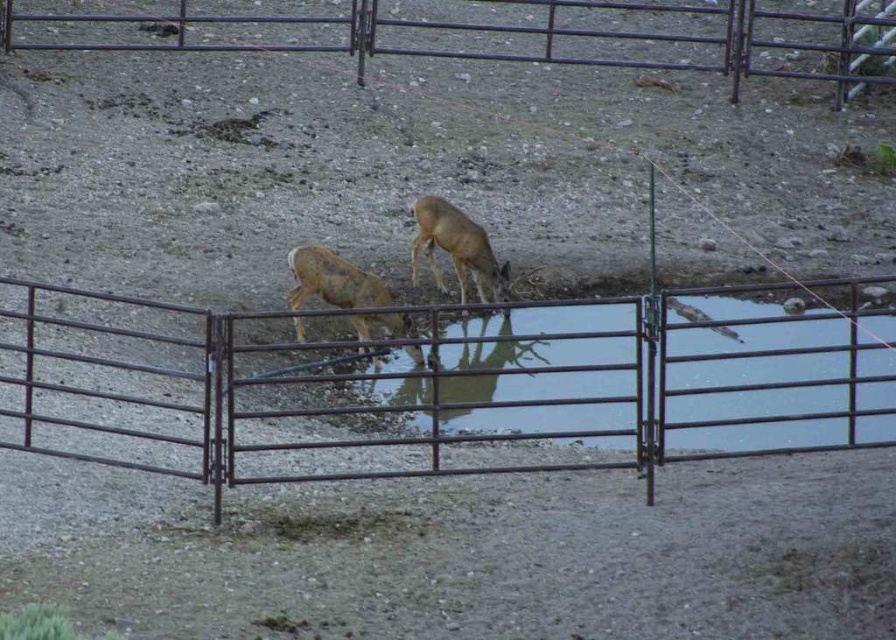
Which is behind, point (851, 92) or point (299, 307)?

The point (851, 92) is behind.

Which of these two, brushed metal fence at upper center or brown matte/deer at center, stands shorter?

With less height is brown matte/deer at center.

Is point (755, 20) in front of point (299, 330)?

That is False.

I want to click on brushed metal fence at upper center, so click(497, 33).

Does point (856, 333) come farther from viewer compared to point (386, 323)?

No, it is in front of (386, 323).

Between point (244, 385) and point (290, 262), which one is positioned behind?

The point (290, 262) is more distant.

Locate an element on the screen. rusty metal gate at center is located at coordinates (433, 388).

Find the location of a particular element. rusty metal gate at center is located at coordinates (433, 388).

Does rusty metal gate at center have a lesser height compared to brushed metal fence at upper center?

Yes, rusty metal gate at center is shorter than brushed metal fence at upper center.

Measure the distance between rusty metal gate at center and camera.

15.07 meters

The image size is (896, 640). Describe the element at coordinates (433, 388) in the screenshot. I see `rusty metal gate at center` at that location.

Locate an element on the screen. The width and height of the screenshot is (896, 640). rusty metal gate at center is located at coordinates (433, 388).